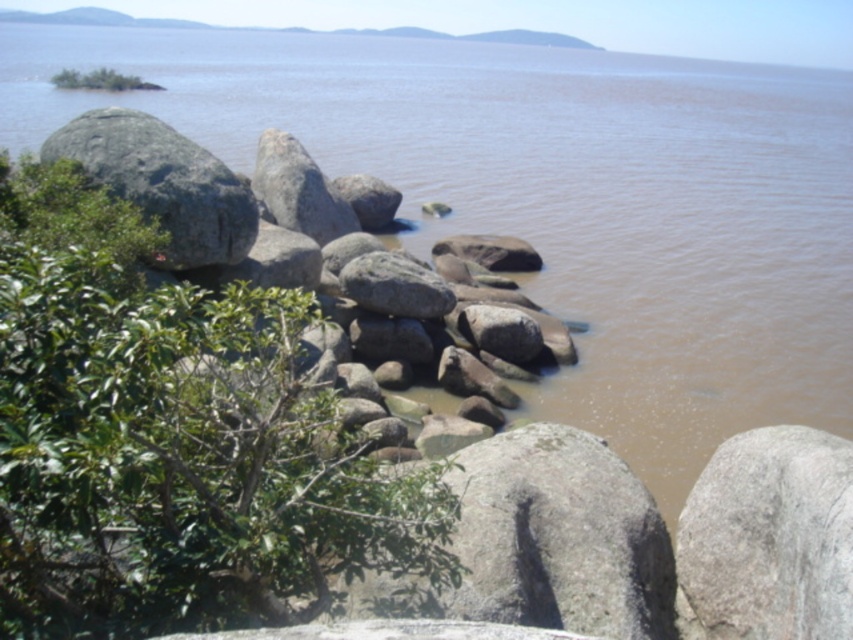
You are standing at the edge of the water in the scene. Which direction should you move to find the gray rough rock at center?

The gray rough rock at center is located at coordinates 0.842 on the x axis and 0.903 on the y axis, so you should move towards the lower right direction to find it.